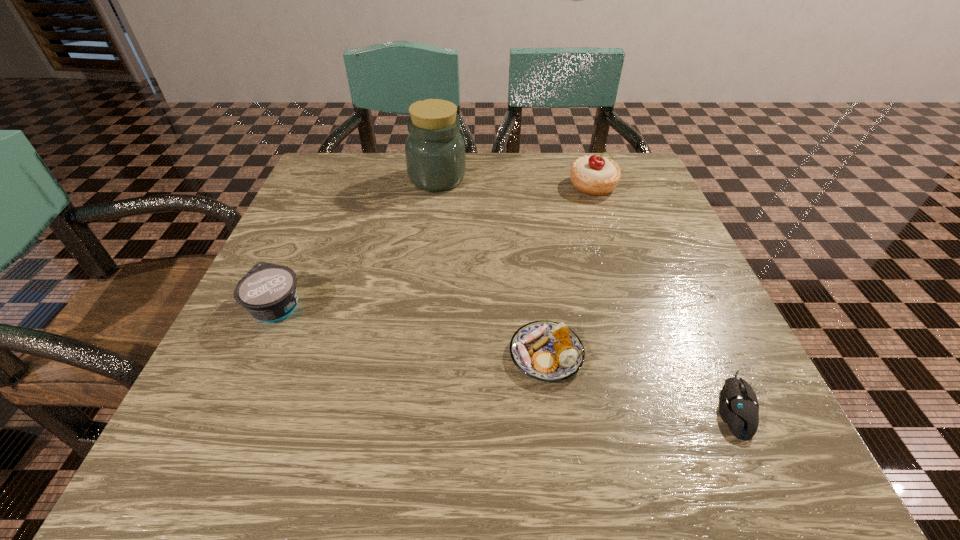
I want to click on vacant space in between the second object from right to left and the rightmost object, so click(x=664, y=295).

The height and width of the screenshot is (540, 960). I want to click on empty location between the rightmost object and the tallest object, so click(587, 292).

Find the location of `free area in between the third shortest object and the fourth tallest object`. free area in between the third shortest object and the fourth tallest object is located at coordinates (412, 330).

The height and width of the screenshot is (540, 960). Find the location of `free spot between the second shortest object and the third tallest object`. free spot between the second shortest object and the third tallest object is located at coordinates (412, 330).

This screenshot has width=960, height=540. Find the location of `vacant area that lies between the fourth shortest object and the shortest object`. vacant area that lies between the fourth shortest object and the shortest object is located at coordinates (664, 295).

Find the location of a particular element. This screenshot has height=540, width=960. vacant area between the farther pastry and the nearer pastry is located at coordinates (569, 270).

Where is `unoccupied position between the taller pastry and the third object from right to left`? unoccupied position between the taller pastry and the third object from right to left is located at coordinates (569, 270).

Where is `free space between the tallest object and the third shortest object`? Image resolution: width=960 pixels, height=540 pixels. free space between the tallest object and the third shortest object is located at coordinates (357, 242).

This screenshot has width=960, height=540. I want to click on free space that is in between the shorter pastry and the computer mouse, so click(x=640, y=380).

I want to click on vacant area that lies between the shortest object and the third object from left to right, so click(640, 380).